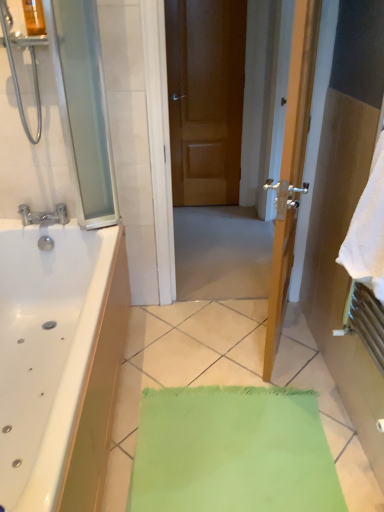
Question: Can you confirm if matte silver faucet at left is wider than white soft towel at right?

Choices:
 (A) no
 (B) yes

Answer: (B)

Question: From the image's perspective, does matte silver faucet at left appear higher than white soft towel at right?

Choices:
 (A) no
 (B) yes

Answer: (B)

Question: Can you confirm if matte silver faucet at left is positioned to the left of white soft towel at right?

Choices:
 (A) yes
 (B) no

Answer: (A)

Question: Is matte silver faucet at left in front of white soft towel at right?

Choices:
 (A) yes
 (B) no

Answer: (B)

Question: Is white soft towel at right inside matte silver faucet at left?

Choices:
 (A) no
 (B) yes

Answer: (A)

Question: Is matte silver faucet at left facing away from white soft towel at right?

Choices:
 (A) no
 (B) yes

Answer: (A)

Question: Can you confirm if transparent glass screen door at left is positioned to the right of brushed metal shower at upper left?

Choices:
 (A) no
 (B) yes

Answer: (B)

Question: Does transparent glass screen door at left touch brushed metal shower at upper left?

Choices:
 (A) no
 (B) yes

Answer: (A)

Question: Is transparent glass screen door at left at the left side of brushed metal shower at upper left?

Choices:
 (A) no
 (B) yes

Answer: (A)

Question: Does transparent glass screen door at left have a lesser height compared to brushed metal shower at upper left?

Choices:
 (A) no
 (B) yes

Answer: (A)

Question: Is transparent glass screen door at left in front of brushed metal shower at upper left?

Choices:
 (A) no
 (B) yes

Answer: (A)

Question: From a real-world perspective, is transparent glass screen door at left beneath brushed metal shower at upper left?

Choices:
 (A) no
 (B) yes

Answer: (B)

Question: Considering the relative sizes of white soft towel at right and transparent glass screen door at left in the image provided, is white soft towel at right shorter than transparent glass screen door at left?

Choices:
 (A) no
 (B) yes

Answer: (B)